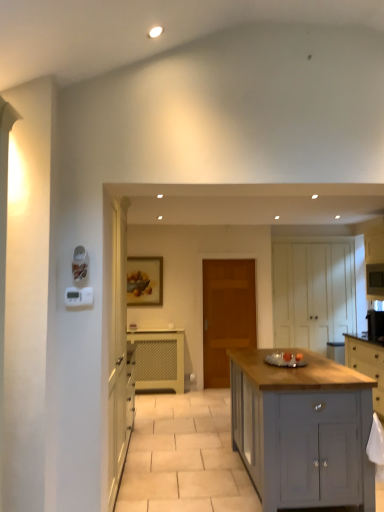
Locate an element on the screen. free region on the left part of matte gray cabinet at center, the 2th cabinetry when ordered from left to right is located at coordinates (184, 483).